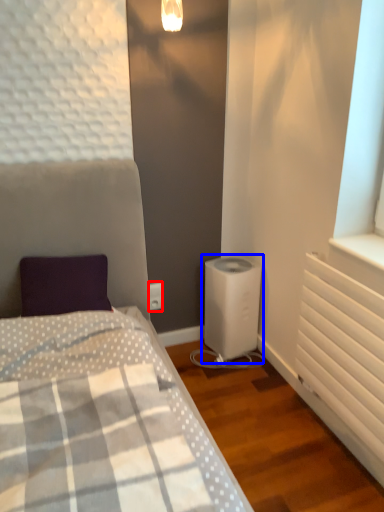
Question: Among these objects, which one is nearest to the camera, electric outlet (highlighted by a red box) or water heater (highlighted by a blue box)?

Choices:
 (A) electric outlet
 (B) water heater

Answer: (B)